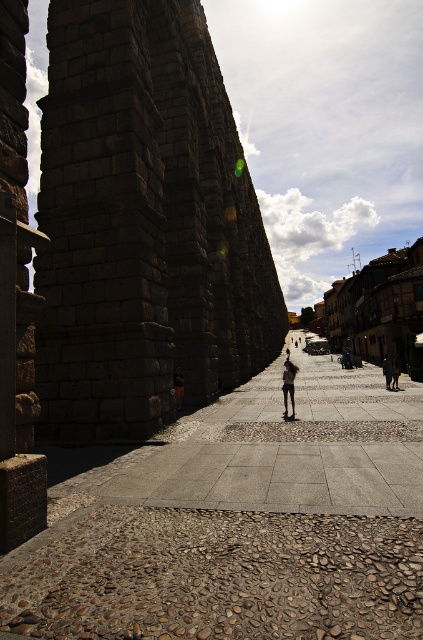
Consider the image. You are standing on the cobblestone pathway leading towards the aqueduct and notice both the brown stone alley at center and the dark blue jeans at center. Which object is closer to you as you face the aqueduct?

The brown stone alley at center is closer to you because it is in front of the dark blue jeans at center.

You are standing at the point labeled point (238, 520) in the image. Which direction should you walk to reach the cobblestone pathway leading towards the large stone aqueduct on the left?

The point (238, 520) is located on the brown stone alley at center. To reach the cobblestone pathway leading towards the large stone aqueduct on the left, you should walk towards the left direction.

You are standing at the entrance of the scene and want to know which object is shorter between the brown stone alley at center and the dark blue jeans at center. Could you determine that?

The brown stone alley at center has a lesser height compared to the dark blue jeans at center, so the brown stone alley at center is shorter.